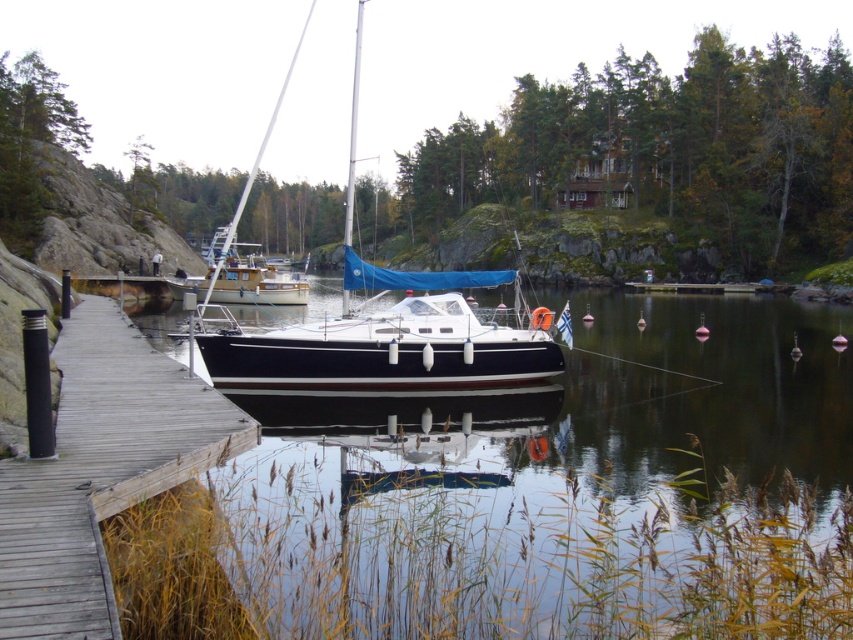
Does clear water at center come in front of wooden dock at center?

No.

Is clear water at center shorter than wooden dock at center?

No, clear water at center is not shorter than wooden dock at center.

Does point (602, 356) come farther from viewer compared to point (112, 344)?

Yes, it is.

Where is `clear water at center`? The image size is (853, 640). clear water at center is located at coordinates (566, 490).

From the picture: Is wooden dock at center further to the viewer compared to black glossy sailboat at center?

No, wooden dock at center is closer to the viewer.

In the scene shown: Which is more to the right, wooden dock at center or black glossy sailboat at center?

wooden dock at center is more to the right.

The width and height of the screenshot is (853, 640). Find the location of `wooden dock at center`. wooden dock at center is located at coordinates click(100, 470).

Does point (717, 324) come farther from viewer compared to point (543, 358)?

That is True.

In the scene shown: Can you confirm if clear water at center is taller than black glossy sailboat at center?

No, clear water at center is not taller than black glossy sailboat at center.

Who is more forward, (x=827, y=476) or (x=305, y=364)?

Point (x=827, y=476) is more forward.

Locate an element on the screen. The height and width of the screenshot is (640, 853). clear water at center is located at coordinates (566, 490).